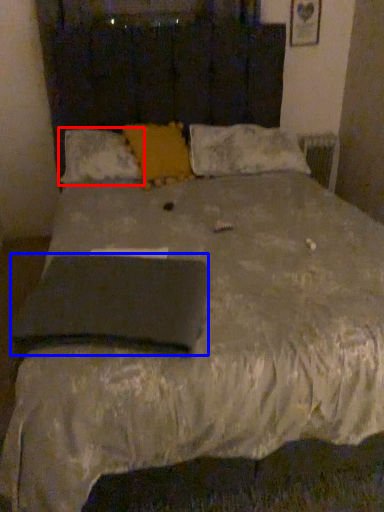
Question: Which object is closer to the camera taking this photo, pillow (highlighted by a red box) or pad (highlighted by a blue box)?

Choices:
 (A) pillow
 (B) pad

Answer: (B)